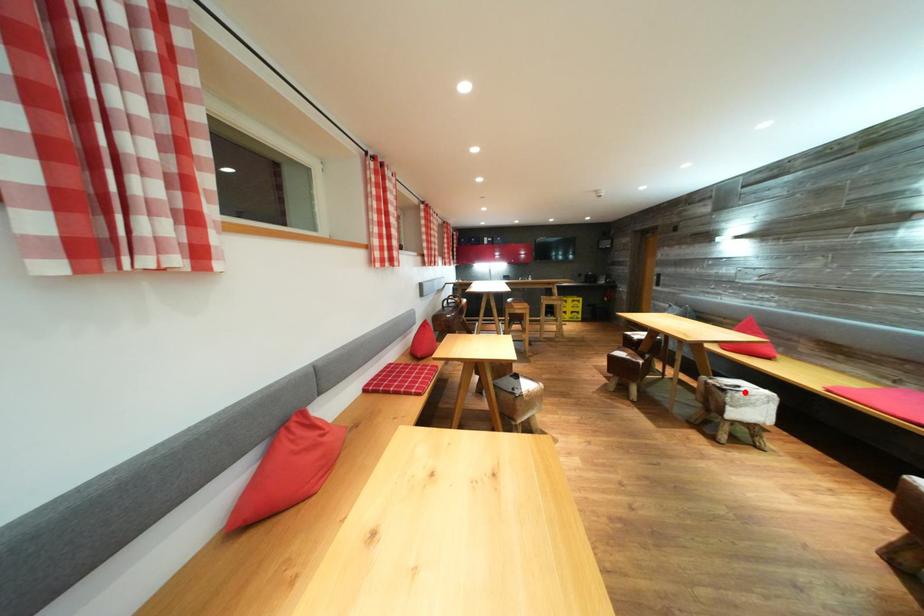
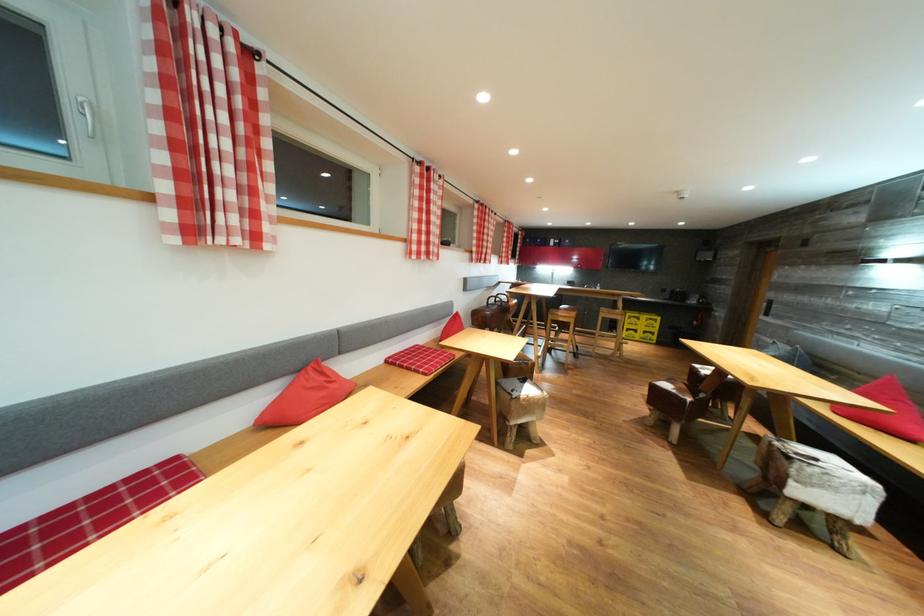
Question: A red point is marked in image1. In image2, is the corresponding 3D point closer to the camera or farther? Reply with the corresponding letter.

Choices:
 (A) The corresponding 3D point is closer.
 (B) The corresponding 3D point is farther.

Answer: (A)